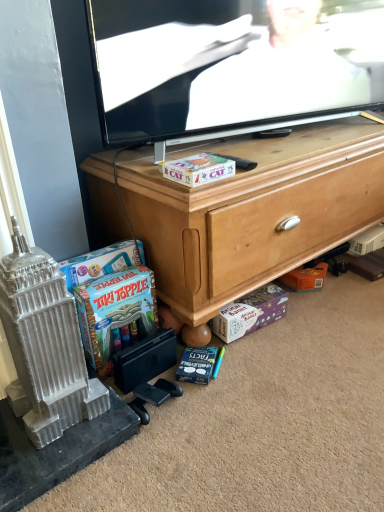
Find the location of `free location in front of blue matte book at lower center`. free location in front of blue matte book at lower center is located at coordinates (206, 415).